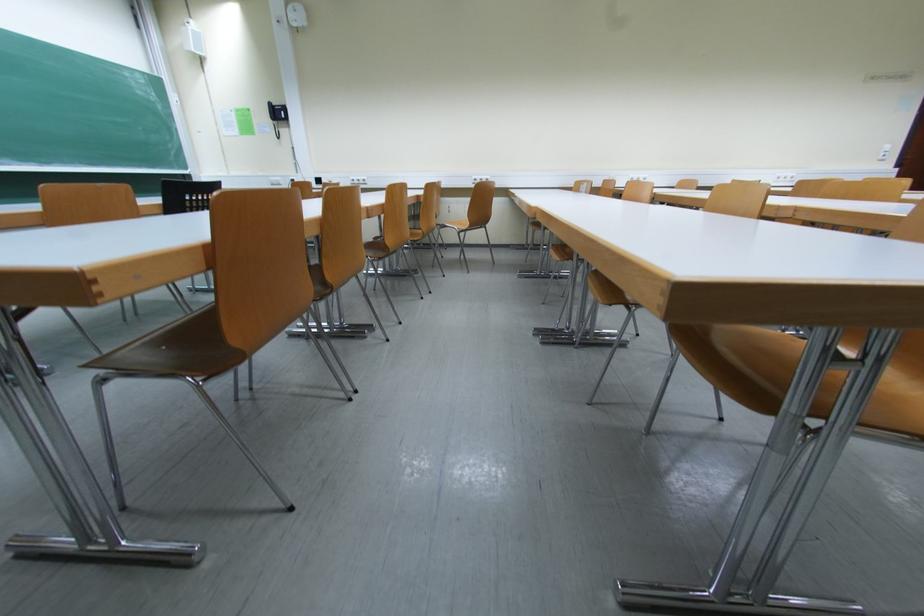
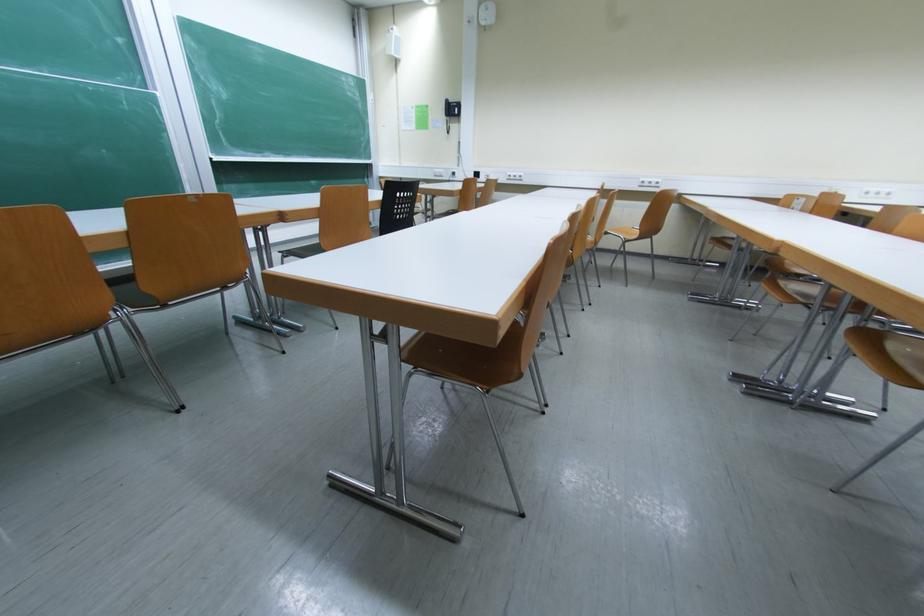
Question: How did the camera likely rotate?

Choices:
 (A) Left
 (B) Right
 (C) Up
 (D) Down

Answer: (A)